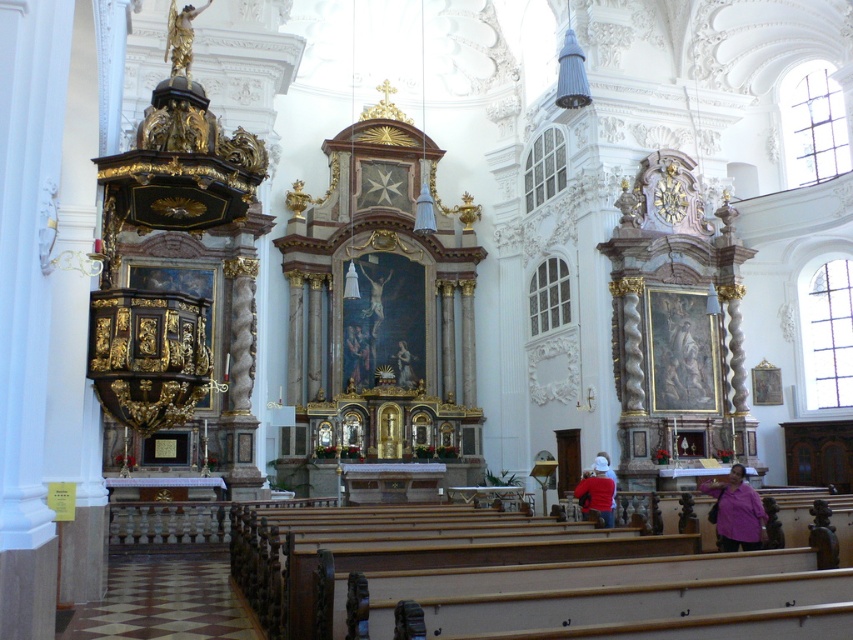
You are an interior designer observing the church interior. You need to place a new decorative item between the red matte jacket at center and the gold textured clock at upper right. Based on their positions, where should the new item be placed?

The new decorative item should be placed between the red matte jacket at center and the gold textured clock at upper right, since the red matte jacket at center is in front of the gold textured clock at upper right, indicating the jacket is closer to the viewer. Therefore, the new item should be positioned behind the red matte jacket at center but in front of the gold textured clock at upper right to maintain spatial order.

You are an interior designer assessing the church layout. You need to place a new decorative item that requires a space taller than the red matte jacket at center. Would the gold textured clock at upper right provide sufficient vertical space?

The red matte jacket at center is not as tall as the gold textured clock at upper right, so the gold textured clock at upper right has enough vertical space to accommodate the new decorative item.